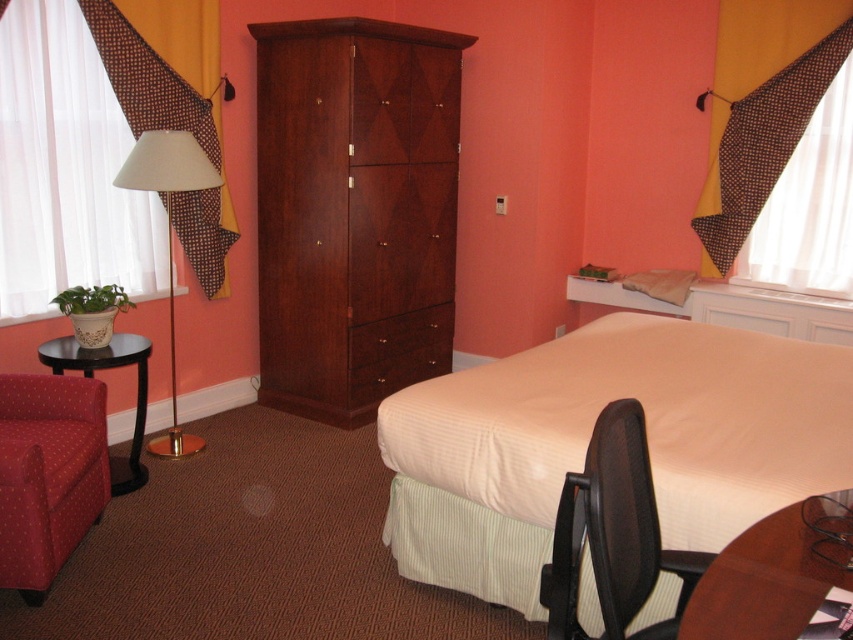
You are standing at the entrance of the hotel room and want to reach the white textured bed at center. According to the room layout, in which direction should you move from your current position?

Since the white textured bed at center is located at point 0.686 on the x and 0.691 on the y coordinates, you should move towards the center of the room to reach it.

Looking at this image, you are a hotel guest who wants to place a rectangular luggage box on the floor between the mahogany wood dresser at center and the brown wood drawer at center. The luggage box is 1.2 meters wide. Can you fit it there?

The mahogany wood dresser at center is wider than the brown wood drawer at center. The space between them may vary depending on their placement, but since the dresser is wider, the gap might be sufficient. However, without exact measurements of the distance between them, it is uncertain if the 1.2 meter wide luggage box will fit. Please check the actual space available.